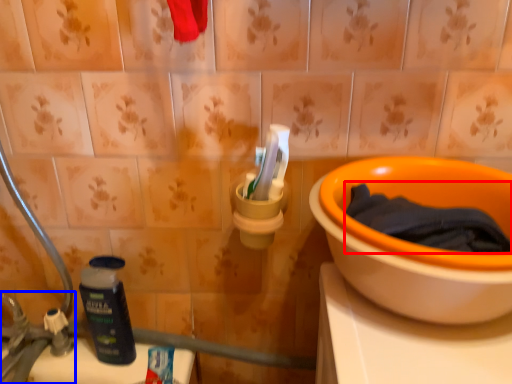
Question: Among these objects, which one is nearest to the camera, bath towel (highlighted by a red box) or faucet (highlighted by a blue box)?

Choices:
 (A) bath towel
 (B) faucet

Answer: (A)